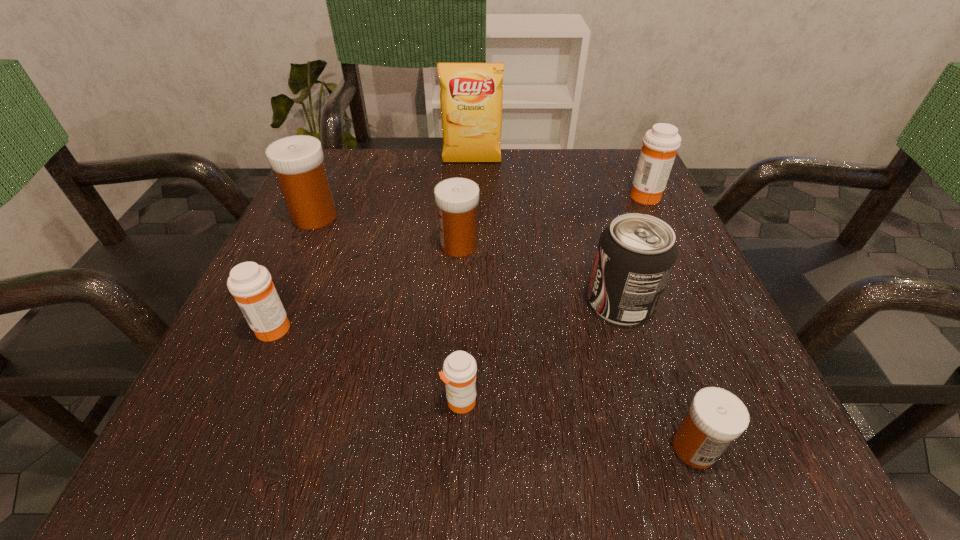
The height and width of the screenshot is (540, 960). Identify the location of vacant area at the left edge. (284, 261).

Image resolution: width=960 pixels, height=540 pixels. Identify the location of free space at the right edge of the desktop. (685, 347).

At what (x,y) coordinates should I click in order to perform the action: click on vacant region at the far left corner of the desktop. Please return your answer as a coordinate pair (x, y). This screenshot has width=960, height=540. Looking at the image, I should click on (337, 167).

Identify the location of vacant space at the near left corner. (176, 469).

Image resolution: width=960 pixels, height=540 pixels. In the image, there is a desktop. Identify the location of free space at the far right corner. (594, 151).

The image size is (960, 540). I want to click on free space between the fourth farthest medicine and the fifth medicine from left to right, so click(484, 387).

The image size is (960, 540). Identify the location of vacant region between the biggest white medicine and the second smallest orange medicine. (294, 272).

This screenshot has width=960, height=540. Identify the location of empty space that is in between the soda can and the farthest white medicine. (468, 260).

The width and height of the screenshot is (960, 540). Find the location of `free space that is in between the biggest white medicine and the second smallest orange medicine`. free space that is in between the biggest white medicine and the second smallest orange medicine is located at coordinates (294, 272).

Locate an element on the screen. This screenshot has height=540, width=960. free space that is in between the crisp (potato chip) and the farthest orange medicine is located at coordinates (559, 179).